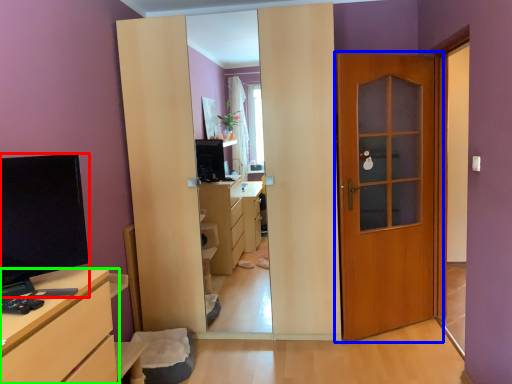
Question: Which object is the farthest from open (highlighted by a red box)? Choose among these: door (highlighted by a blue box) or chest of drawers (highlighted by a green box).

Choices:
 (A) door
 (B) chest of drawers

Answer: (A)